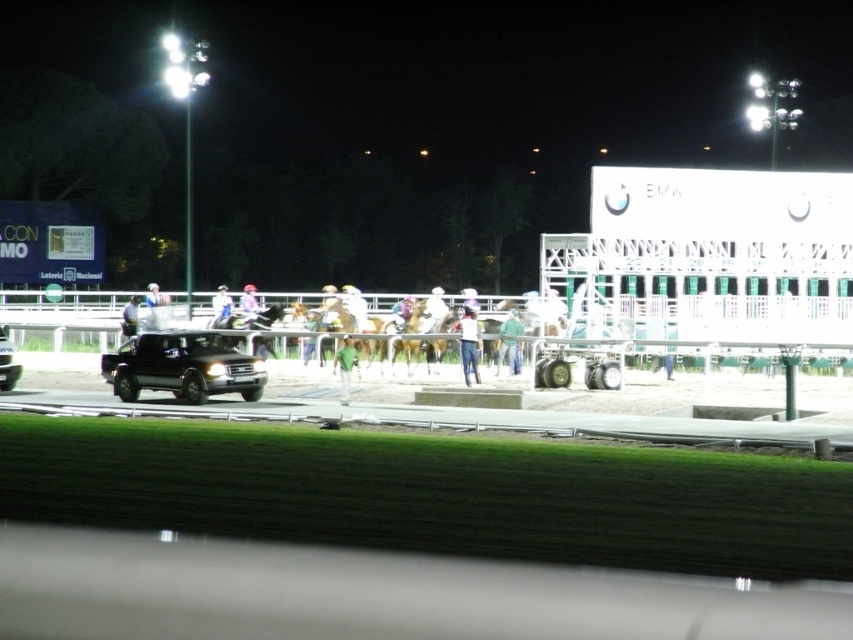
You are a photographer at the horse racing track and want to capture both the white matte helmet at center and the white fabric helmet at center in a single photo. Which helmet should you position to the left to include both in the frame?

The white matte helmet at center is positioned on the right side of the white fabric helmet at center, so to include both in the frame, you should position the white fabric helmet at center to the left.

You are a photographer standing at the edge of the horse racing track at night. You want to take a photo of both the white matte helmet at center and the white fabric helmet at center in the same frame. The camera you are using has a maximum focus range of 10 meters. Will you be able to capture both helmets in focus without moving your position?

The white matte helmet at center and white fabric helmet at center are 11.63 meters apart, which exceeds the camera maximum focus range of 10 meters. Therefore, you won not be able to capture both helmets in focus without moving your position.

You are standing at the edge of the horse racing track at night. You see the blue jeans at center. Where exactly is the blue jeans located in terms of coordinates?

The blue jeans at center is located at coordinates point (468, 342).